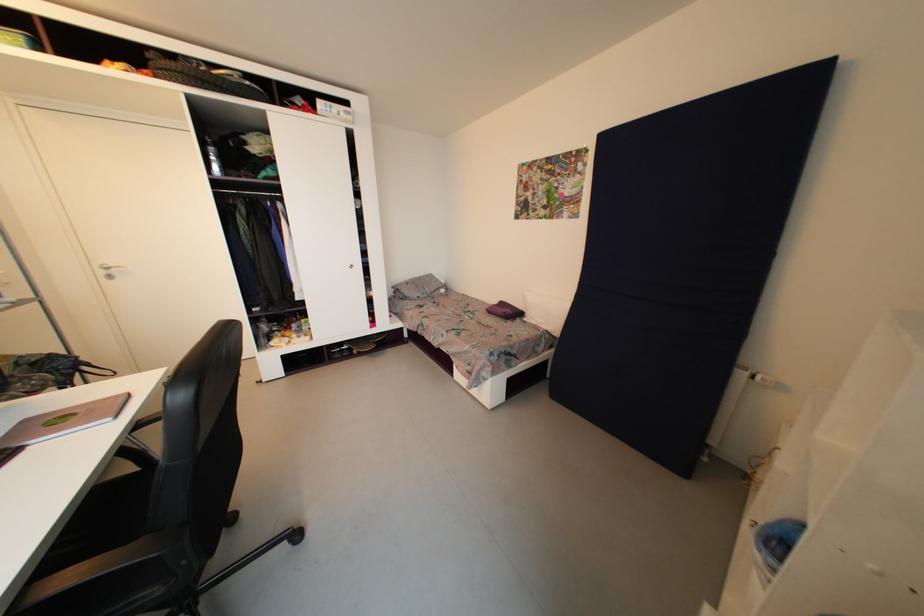
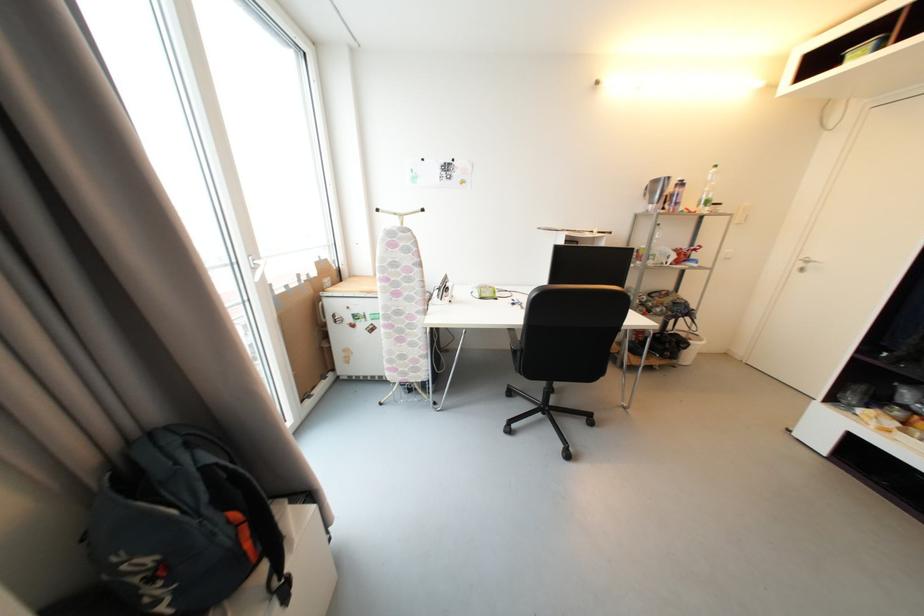
Locate, in the second image, the point that corresponds to [108,274] in the first image.

(806, 267)